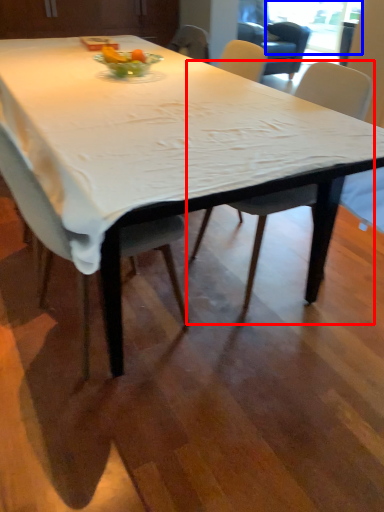
Question: Which object is closer to the camera taking this photo, chair (highlighted by a red box) or window screen (highlighted by a blue box)?

Choices:
 (A) chair
 (B) window screen

Answer: (A)